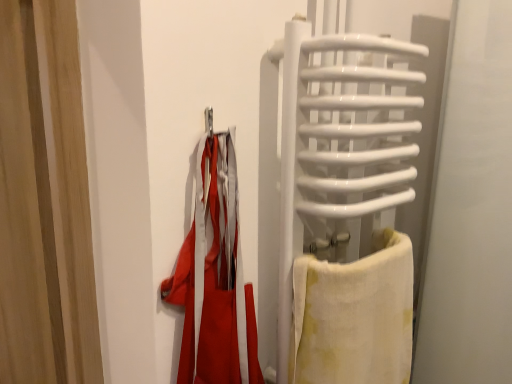
Question: Considering the relative positions of white cotton towel at right and white glossy towel rack at right in the image provided, is white cotton towel at right in front of white glossy towel rack at right?

Choices:
 (A) yes
 (B) no

Answer: (B)

Question: Is white cotton towel at right further to camera compared to white glossy towel rack at right?

Choices:
 (A) no
 (B) yes

Answer: (B)

Question: Is white glossy towel rack at right at the back of white cotton towel at right?

Choices:
 (A) yes
 (B) no

Answer: (A)

Question: Is white cotton towel at right smaller than white glossy towel rack at right?

Choices:
 (A) yes
 (B) no

Answer: (A)

Question: Considering the relative positions of white cotton towel at right and white glossy towel rack at right in the image provided, is white cotton towel at right to the left of white glossy towel rack at right from the viewer's perspective?

Choices:
 (A) yes
 (B) no

Answer: (B)

Question: Can you confirm if white cotton towel at right is bigger than white glossy towel rack at right?

Choices:
 (A) yes
 (B) no

Answer: (B)

Question: Is white glossy towel rack at right positioned beyond the bounds of wooden curtain at left?

Choices:
 (A) no
 (B) yes

Answer: (B)

Question: Can you confirm if white glossy towel rack at right is bigger than wooden curtain at left?

Choices:
 (A) no
 (B) yes

Answer: (A)

Question: From the image's perspective, would you say white glossy towel rack at right is shown under wooden curtain at left?

Choices:
 (A) no
 (B) yes

Answer: (A)

Question: From the image's perspective, is white glossy towel rack at right on top of wooden curtain at left?

Choices:
 (A) yes
 (B) no

Answer: (A)

Question: Considering the relative positions of white glossy towel rack at right and wooden curtain at left in the image provided, is white glossy towel rack at right behind wooden curtain at left?

Choices:
 (A) no
 (B) yes

Answer: (A)

Question: Is white glossy towel rack at right turned away from wooden curtain at left?

Choices:
 (A) yes
 (B) no

Answer: (B)

Question: From the image's perspective, would you say wooden curtain at left is shown under white glossy towel rack at right?

Choices:
 (A) yes
 (B) no

Answer: (A)